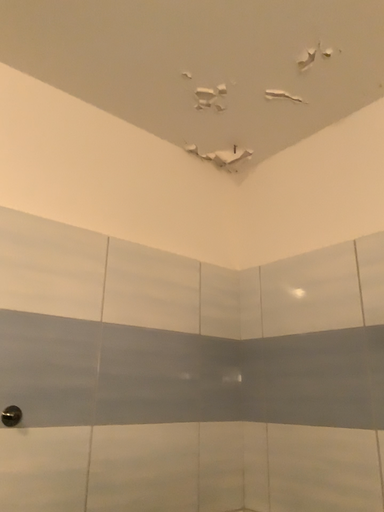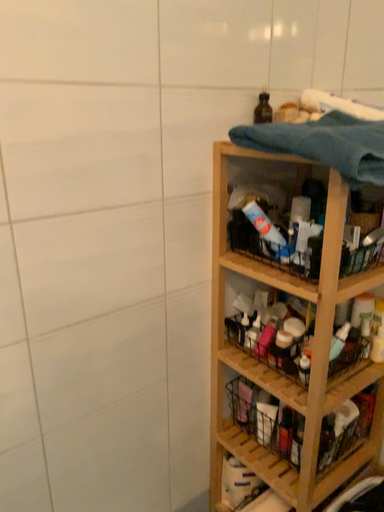
Question: How did the camera likely rotate when shooting the video?

Choices:
 (A) rotated downward
 (B) rotated upward

Answer: (A)